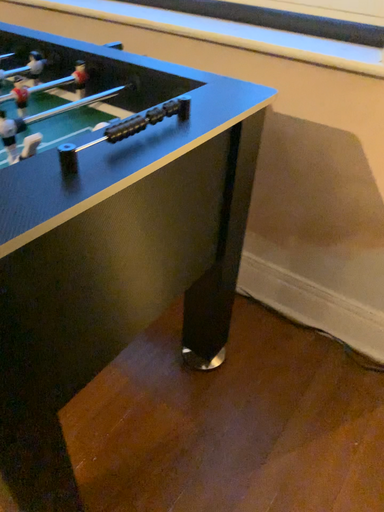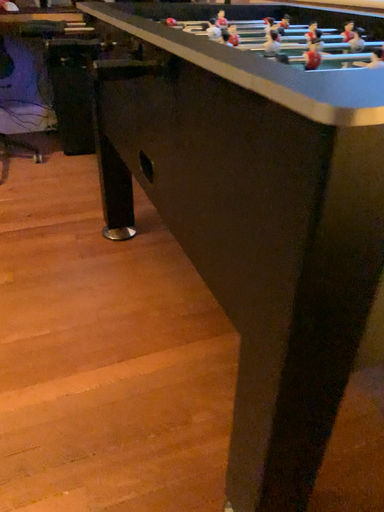
Question: Which way did the camera rotate in the video?

Choices:
 (A) rotated upward
 (B) rotated downward

Answer: (A)